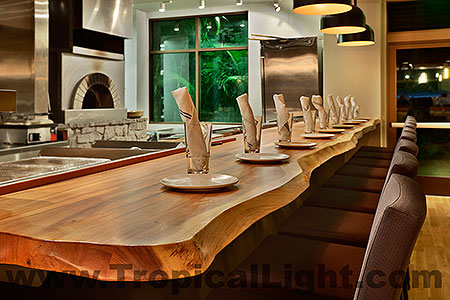
Identify the location of plates. The width and height of the screenshot is (450, 300). point(220,183), point(277,156), point(295,146), point(320,132).